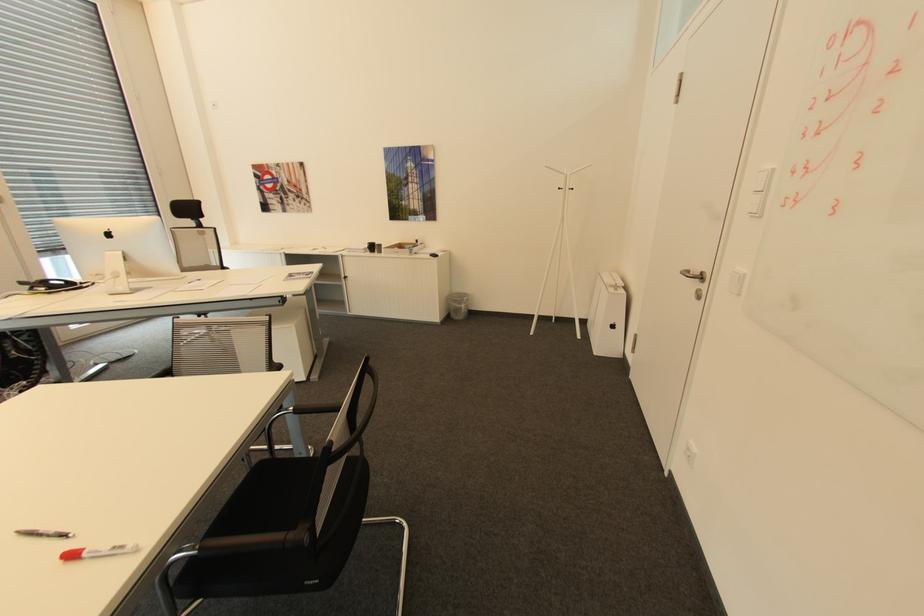
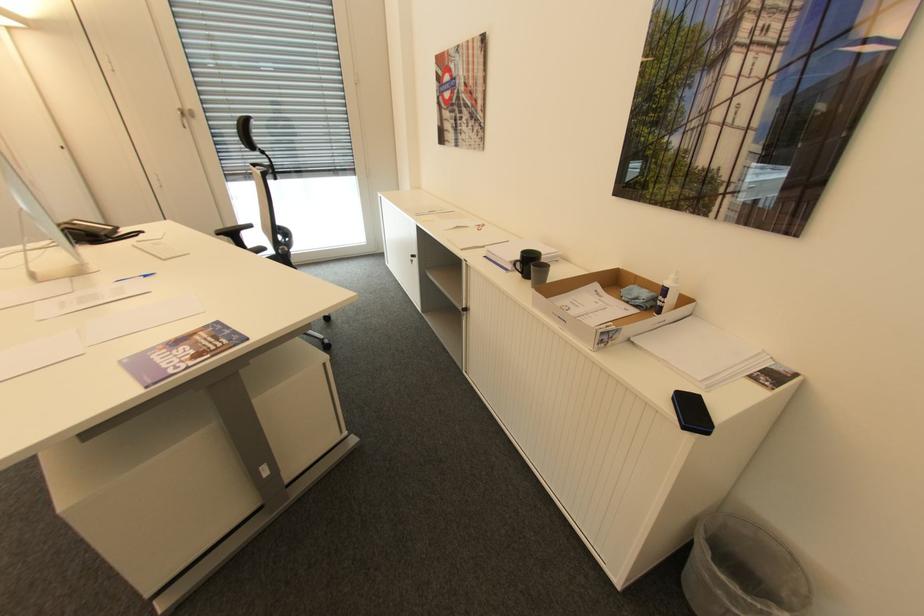
Find the pixel in the second image that matches pixel 420 240 in the first image.

(670, 291)